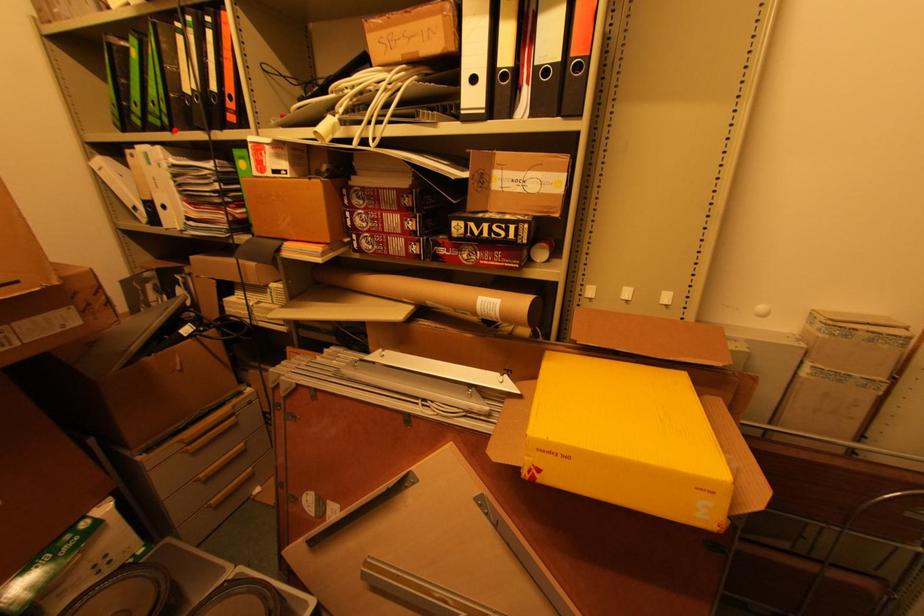
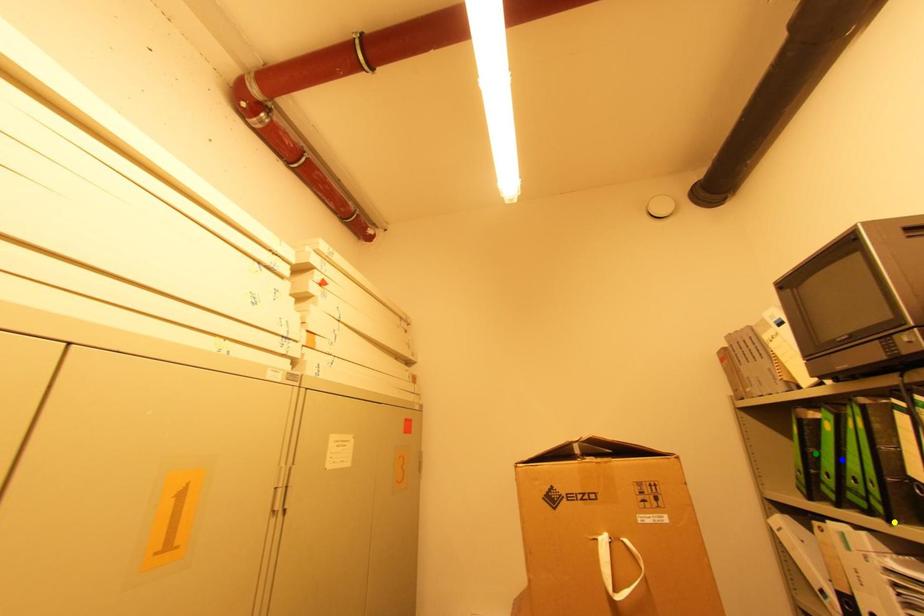
Question: I am providing you with two images of the same scene from different viewpoints. A red point is marked on the first image. You are given multiple points on the second image. In image 2, which mark is for the same physical point as the one in image 1?

Choices:
 (A) green point
 (B) yellow point
 (C) blue point

Answer: (B)